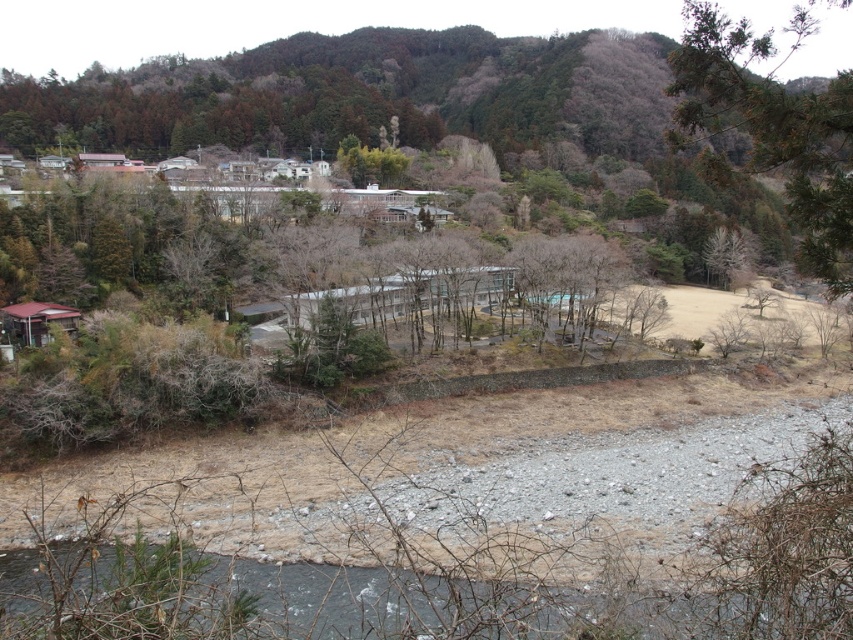
Question: Is green textured pine branch at upper right wider than green leafy tree at center?

Choices:
 (A) no
 (B) yes

Answer: (B)

Question: Is green textured pine branch at upper right to the left of green leafy tree at center from the viewer's perspective?

Choices:
 (A) no
 (B) yes

Answer: (A)

Question: Does gray gravel river at lower center have a smaller size compared to green textured pine branch at upper right?

Choices:
 (A) yes
 (B) no

Answer: (A)

Question: Among these points, which one is farthest from the camera?

Choices:
 (A) (398, 157)
 (B) (809, 211)

Answer: (A)

Question: Among these objects, which one is farthest from the camera?

Choices:
 (A) green textured pine branch at upper right
 (B) gray gravel river at lower center

Answer: (A)

Question: Which point appears farthest from the camera in this image?

Choices:
 (A) (189, 628)
 (B) (335, 157)

Answer: (B)